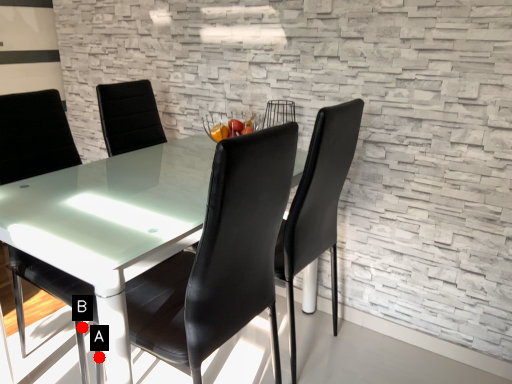
Question: Two points are circled on the image, labeled by A and B beside each circle. Which point is closer to the camera?

Choices:
 (A) A is closer
 (B) B is closer

Answer: (A)